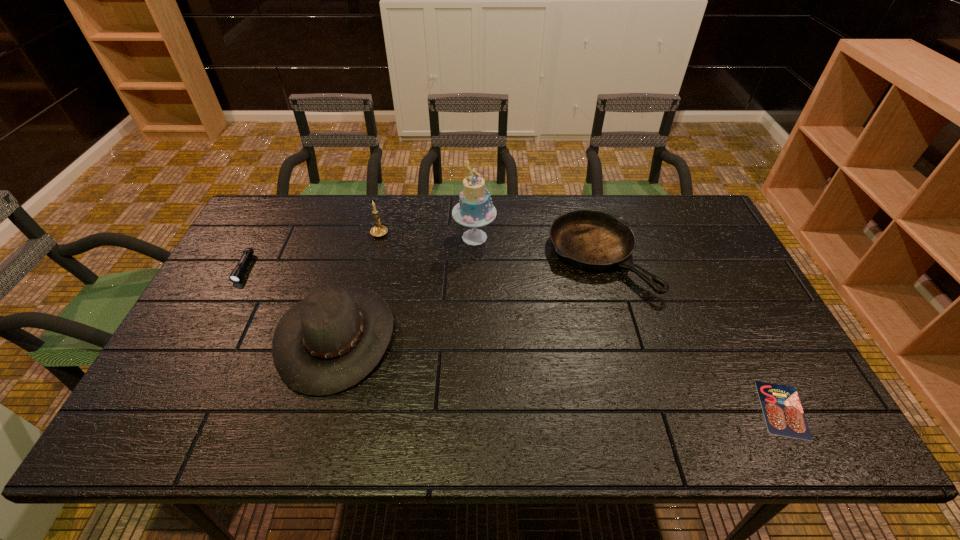
Locate an element on the screen. This screenshot has height=540, width=960. free spot between the candle holder and the cake is located at coordinates (427, 234).

Identify the location of vacant area that lies between the candle holder and the second object from right to left. The height and width of the screenshot is (540, 960). (490, 245).

Locate an element on the screen. The width and height of the screenshot is (960, 540). empty location between the fourth object from left to right and the flashlight is located at coordinates (359, 253).

Locate an element on the screen. free space between the candle holder and the frying pan is located at coordinates (490, 245).

The image size is (960, 540). In order to click on empty location between the shortest object and the second shortest object in this screenshot , I will do `click(514, 339)`.

Where is `vacant point located between the tallest object and the third shortest object`? Image resolution: width=960 pixels, height=540 pixels. vacant point located between the tallest object and the third shortest object is located at coordinates (x=537, y=247).

Identify the location of vacant space that's between the candle holder and the second shortest object. (312, 250).

Where is `vacant space that is in between the rightmost object and the tallest object`? vacant space that is in between the rightmost object and the tallest object is located at coordinates (629, 323).

Locate which object is the fifth closest to the second shortest object. Please provide its 2D coordinates. Your answer should be formatted as a tuple, i.e. [(x, y)], where the tuple contains the x and y coordinates of a point satisfying the conditions above.

[(784, 416)]

Where is `the third closest object to the flashlight`? Image resolution: width=960 pixels, height=540 pixels. the third closest object to the flashlight is located at coordinates (475, 209).